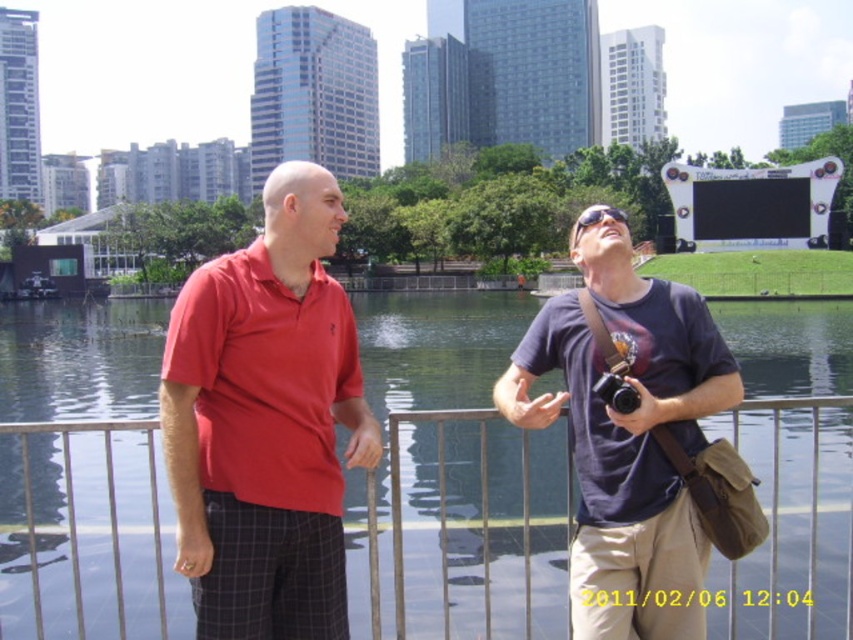
You are a photographer trying to capture a photo of the matte red polo shirt at left and the black plastic camera at center. Since you want both subjects to be clearly visible, which one should you focus on first to ensure proper framing?

The matte red polo shirt at left is much taller than the black plastic camera at center, so you should focus on the matte red polo shirt at left first to ensure proper framing.